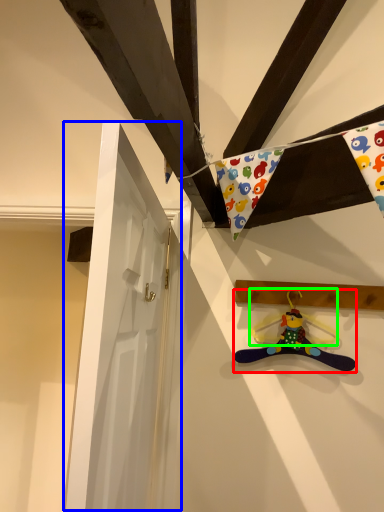
Question: Which object is positioned closest to toy (highlighted by a red box)? Select from door (highlighted by a blue box) and hanger (highlighted by a green box).

Choices:
 (A) door
 (B) hanger

Answer: (B)